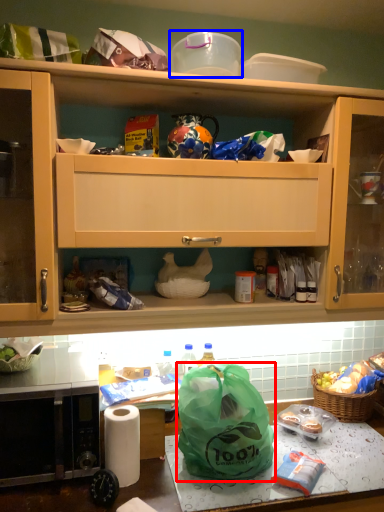
Question: Which object appears farthest to the camera in this image, plastic bag (highlighted by a red box) or appliance (highlighted by a blue box)?

Choices:
 (A) plastic bag
 (B) appliance

Answer: (B)